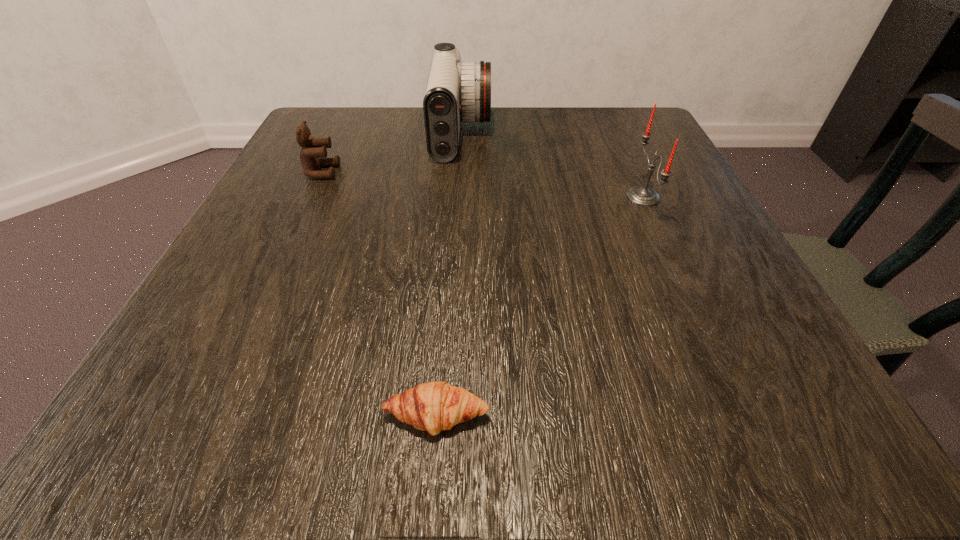
You are a GUI agent. You are given a task and a screenshot of the screen. Output one action in this format:
    pyautogui.click(x=<x>, y=<y>)
    Task: Click on the empty space that is in between the candle and the pastry
    
    Given the screenshot: What is the action you would take?
    pyautogui.click(x=540, y=307)

Locate an element on the screen. The width and height of the screenshot is (960, 540). object identified as the third closest to the second shortest object is located at coordinates (643, 196).

Find the location of `object that is the closest to the camcorder`. object that is the closest to the camcorder is located at coordinates (313, 153).

Locate an element on the screen. vacant region that satisfies the following two spatial constraints: 1. on the front-facing side of the candle; 2. on the front-facing side of the shortest object is located at coordinates (741, 416).

The image size is (960, 540). I want to click on vacant space that satisfies the following two spatial constraints: 1. on the front-facing side of the rightmost object; 2. on the front-facing side of the nearest object, so click(x=741, y=416).

The width and height of the screenshot is (960, 540). Identify the location of free region that satisfies the following two spatial constraints: 1. on the front-facing side of the candle; 2. on the front-facing side of the nearest object. (741, 416).

Locate an element on the screen. This screenshot has height=540, width=960. free space that satisfies the following two spatial constraints: 1. on the front-facing side of the rightmost object; 2. on the front-facing side of the pastry is located at coordinates (741, 416).